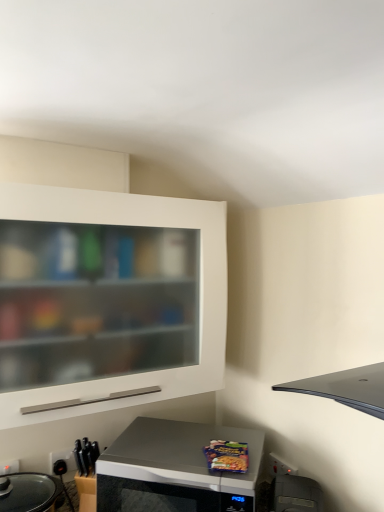
Question: Considering the relative positions of silver metallic microwave at lower center and black plastic toaster at lower right in the image provided, is silver metallic microwave at lower center to the right of black plastic toaster at lower right from the viewer's perspective?

Choices:
 (A) no
 (B) yes

Answer: (A)

Question: Does silver metallic microwave at lower center have a smaller size compared to black plastic toaster at lower right?

Choices:
 (A) yes
 (B) no

Answer: (B)

Question: From the image's perspective, is silver metallic microwave at lower center over black plastic toaster at lower right?

Choices:
 (A) yes
 (B) no

Answer: (B)

Question: Is silver metallic microwave at lower center located outside black plastic toaster at lower right?

Choices:
 (A) no
 (B) yes

Answer: (B)

Question: Does silver metallic microwave at lower center have a greater width compared to black plastic toaster at lower right?

Choices:
 (A) no
 (B) yes

Answer: (B)

Question: Is silver metallic microwave at lower center closer to camera compared to black plastic toaster at lower right?

Choices:
 (A) no
 (B) yes

Answer: (A)

Question: Is white matte cabinet at upper left surrounding silver metallic microwave at lower center?

Choices:
 (A) no
 (B) yes

Answer: (A)

Question: From a real-world perspective, is white matte cabinet at upper left beneath silver metallic microwave at lower center?

Choices:
 (A) no
 (B) yes

Answer: (A)

Question: From a real-world perspective, is white matte cabinet at upper left on top of silver metallic microwave at lower center?

Choices:
 (A) yes
 (B) no

Answer: (A)

Question: Can you see white matte cabinet at upper left touching silver metallic microwave at lower center?

Choices:
 (A) no
 (B) yes

Answer: (A)

Question: Is white matte cabinet at upper left to the right of silver metallic microwave at lower center from the viewer's perspective?

Choices:
 (A) no
 (B) yes

Answer: (A)

Question: Is white matte cabinet at upper left far from silver metallic microwave at lower center?

Choices:
 (A) yes
 (B) no

Answer: (B)

Question: Is silver metallic microwave at lower center completely or partially outside of black plastic electric outlet at lower left?

Choices:
 (A) no
 (B) yes

Answer: (B)